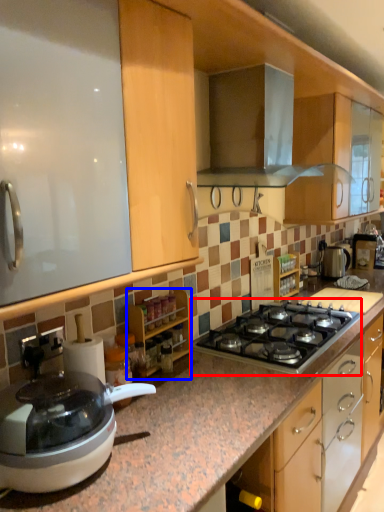
Question: Which point is closer to the camera, gas stove (highlighted by a red box) or cabinetry (highlighted by a blue box)?

Choices:
 (A) gas stove
 (B) cabinetry

Answer: (B)